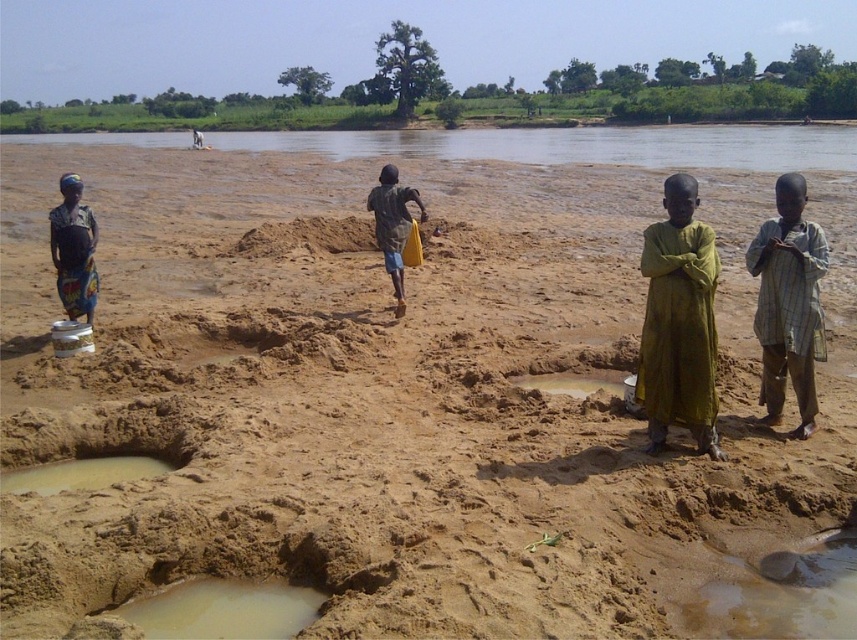
Question: Is green cloth at center below muddy sand pit at lower left?

Choices:
 (A) yes
 (B) no

Answer: (B)

Question: Which of the following is the closest to the observer?

Choices:
 (A) (87, 225)
 (B) (49, 461)

Answer: (B)

Question: Considering the real-world distances, which object is closest to the greenish clay hole at lower left?

Choices:
 (A) green cloth at center
 (B) brown sandy river at center
 (C) muddy sand pit at lower left
 (D) light brown plaid shirt at right

Answer: (C)

Question: Estimate the real-world distances between objects in this image. Which object is closer to the yellow fabric bag at center?

Choices:
 (A) matte green dress at left
 (B) green cloth at center
 (C) light brown plaid shirt at right

Answer: (A)

Question: Does brown sandy river at center appear on the right side of green cloth at center?

Choices:
 (A) no
 (B) yes

Answer: (A)

Question: Observing the image, what is the correct spatial positioning of brown sandy river at center in reference to green cloth at center?

Choices:
 (A) above
 (B) below

Answer: (A)